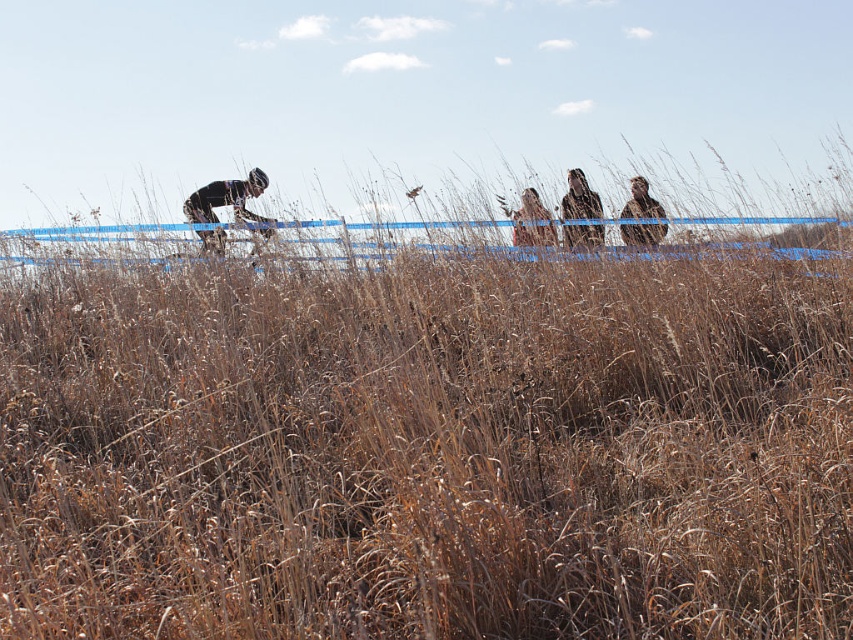
Question: Which point is closer to the camera?

Choices:
 (A) dark brown leather jacket at upper center
 (B) brown fur coat at upper center

Answer: (A)

Question: Which object is the farthest from the dark brown leather jacket at upper center?

Choices:
 (A) light brown hair at upper center
 (B) brown fur coat at upper center

Answer: (B)

Question: Does dark brown leather jacket at upper center lie in front of brown fur coat at upper center?

Choices:
 (A) no
 (B) yes

Answer: (B)

Question: In this image, where is dark brown leather jacket at upper center located relative to light brown hair at upper center?

Choices:
 (A) below
 (B) above

Answer: (B)

Question: Estimate the real-world distances between objects in this image. Which object is closer to the dark brown leather jacket at upper center?

Choices:
 (A) matte black cycling suit at left
 (B) light brown hair at upper center

Answer: (B)

Question: Can you confirm if matte black cycling suit at left is smaller than dark brown leather jacket at upper center?

Choices:
 (A) no
 (B) yes

Answer: (A)